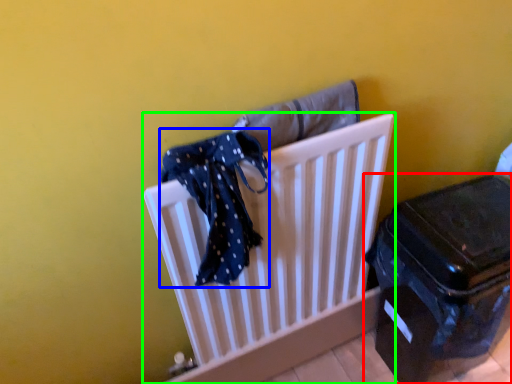
Question: Based on their relative distances, which object is farther from suitcase (highlighted by a red box)? Choose from scarf (highlighted by a blue box) and furniture (highlighted by a green box).

Choices:
 (A) scarf
 (B) furniture

Answer: (A)